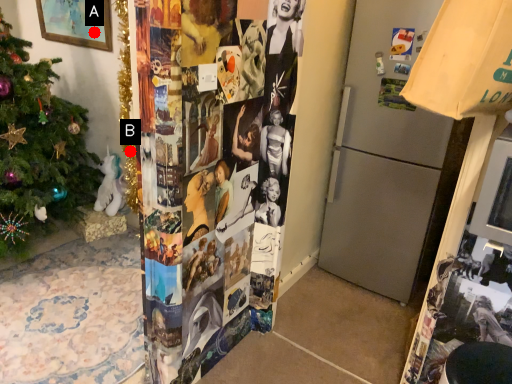
Question: Two points are circled on the image, labeled by A and B beside each circle. Which point is closer to the camera?

Choices:
 (A) A is closer
 (B) B is closer

Answer: (B)